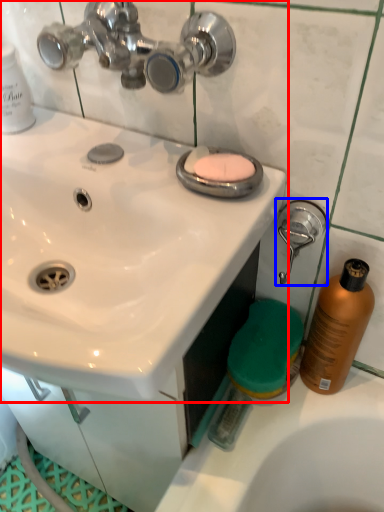
Question: Which object appears farthest to the camera in this image, sink (highlighted by a red box) or shower (highlighted by a blue box)?

Choices:
 (A) sink
 (B) shower

Answer: (B)